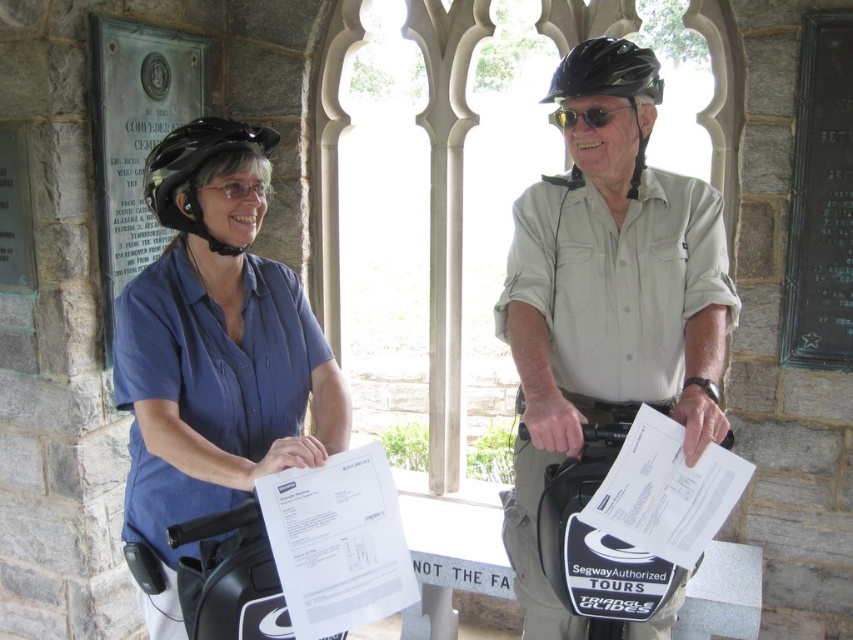
You are a photographer trying to capture a clear photo of both the khaki cotton shirt at center and the black matte bicycle helmet at upper center. Which object should you focus on first if you want to ensure both are in focus, considering their sizes?

The khaki cotton shirt at center is wider than the black matte bicycle helmet at upper center, so focusing on the khaki cotton shirt at center first would help ensure both are in focus as it occupies more space in the frame.

What is located at the coordinate point (608, 83) in the image?

The black matte bicycle helmet at upper center is located at point (608, 83).